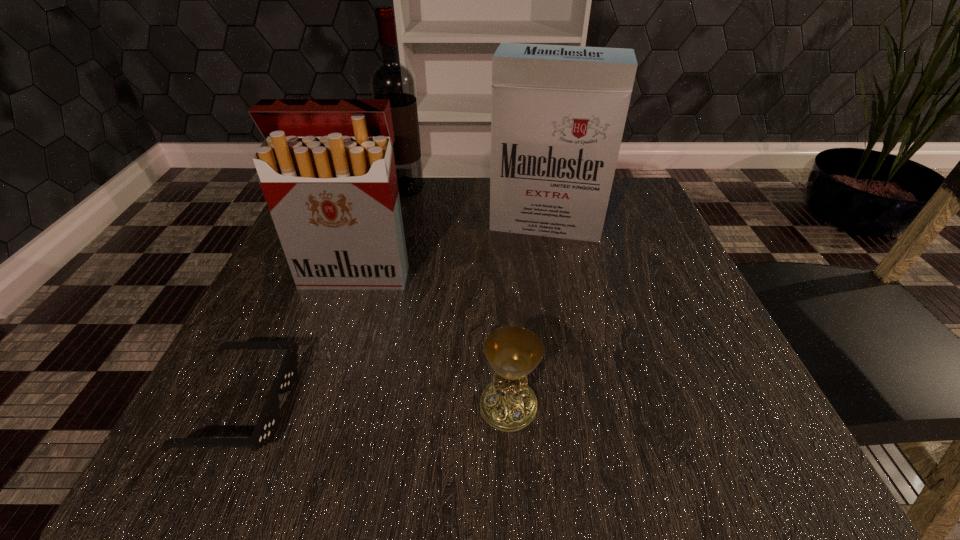
Locate an element on the screen. object at the far left corner is located at coordinates (391, 80).

I want to click on object at the near left corner, so click(265, 427).

Image resolution: width=960 pixels, height=540 pixels. Identify the location of object located in the far right corner section of the desktop. (558, 113).

Image resolution: width=960 pixels, height=540 pixels. What are the coordinates of `free space at the far edge` in the screenshot? It's located at click(402, 208).

The width and height of the screenshot is (960, 540). What are the coordinates of `free space at the near edge` in the screenshot? It's located at (410, 417).

Find the location of a particular element. The width and height of the screenshot is (960, 540). vacant area at the left edge of the desktop is located at coordinates (271, 280).

You are a GUI agent. You are given a task and a screenshot of the screen. Output one action in this format:
    pyautogui.click(x=<x>, y=<y>)
    Task: Click on the vacant space at the right edge of the desktop
    
    Given the screenshot: What is the action you would take?
    pyautogui.click(x=604, y=282)

This screenshot has height=540, width=960. I want to click on vacant space at the far right corner of the desktop, so click(x=645, y=195).

This screenshot has height=540, width=960. In the image, there is a desktop. What are the coordinates of `free region at the near right corner` in the screenshot? It's located at (746, 412).

The image size is (960, 540). In order to click on vacant space that is in between the shortest object and the nearer cigarette case in this screenshot , I will do `click(300, 339)`.